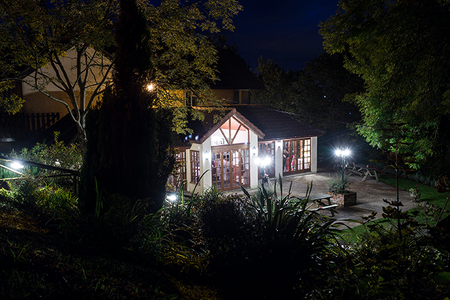
Image resolution: width=450 pixels, height=300 pixels. I want to click on door, so click(231, 176).